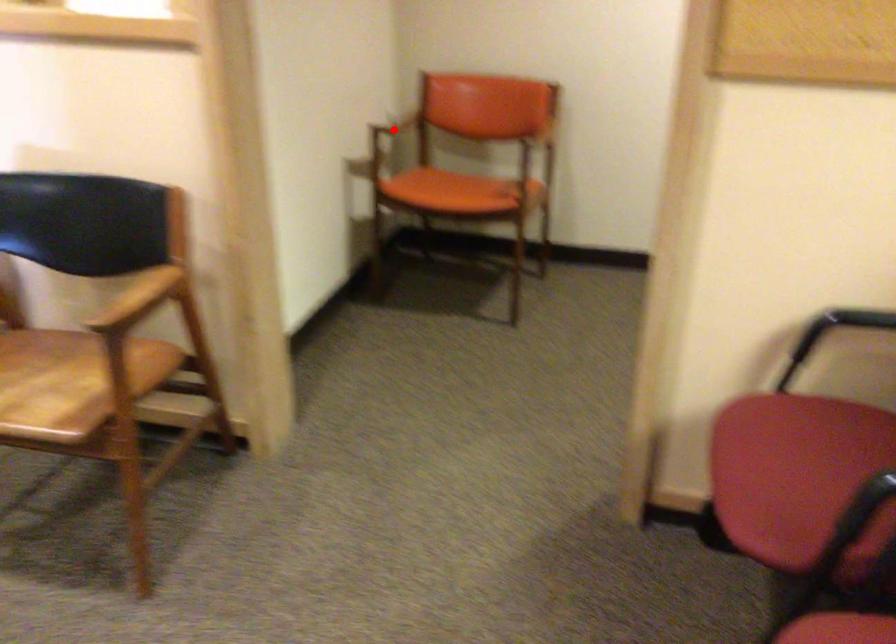
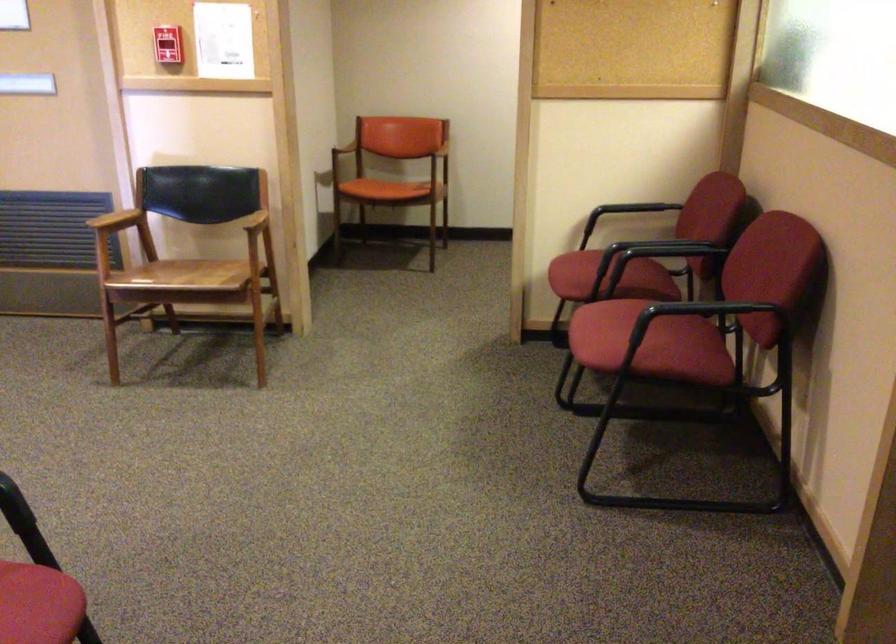
Question: I am providing you with two images of the same scene from different viewpoints. A red point is shown in image1. For the corresponding object point in image2, is it positioned nearer or farther from the camera?

Choices:
 (A) Nearer
 (B) Farther

Answer: (B)